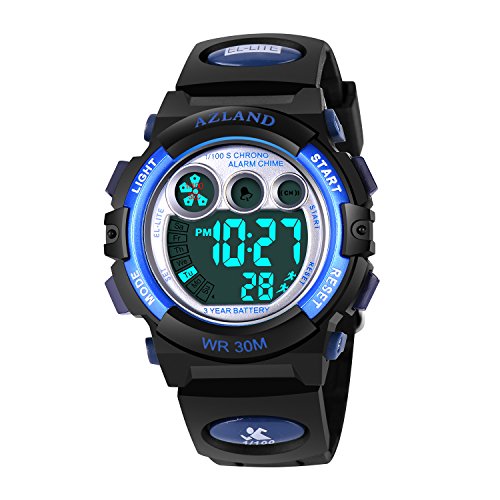
Find the location of a particular element. This screenshot has height=500, width=500. alarm is located at coordinates (247, 194).